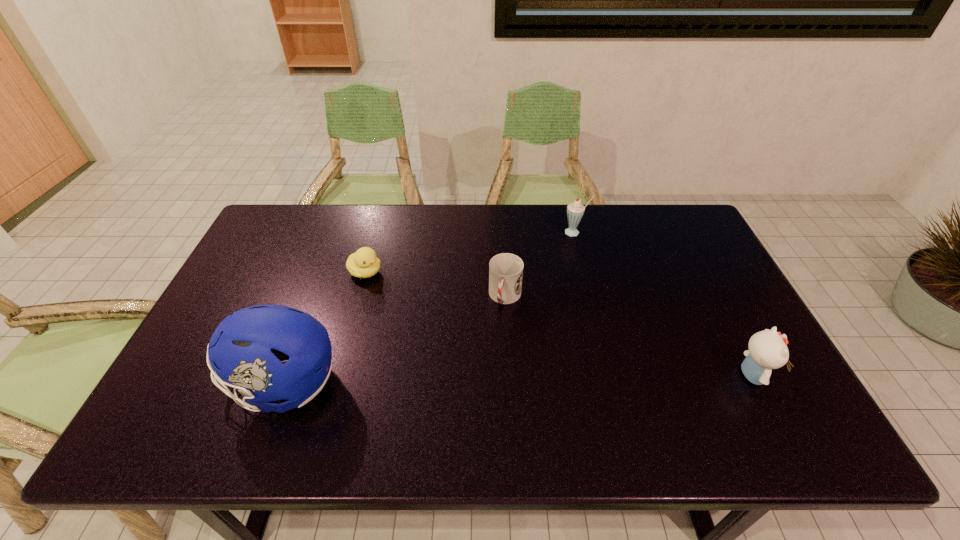
Identify the location of football helmet. The height and width of the screenshot is (540, 960). (246, 349).

Where is `the rightmost object`? the rightmost object is located at coordinates (768, 350).

Find the location of `cup`. cup is located at coordinates (505, 270).

I want to click on duckling, so click(364, 263).

Image resolution: width=960 pixels, height=540 pixels. Find the location of `the fourth object from left to right`. the fourth object from left to right is located at coordinates pyautogui.click(x=575, y=210).

The width and height of the screenshot is (960, 540). I want to click on milkshake, so click(x=575, y=210).

Find the location of a particular element. The width and height of the screenshot is (960, 540). vacant position located 0.120m on the face guard of the football helmet is located at coordinates click(175, 385).

This screenshot has width=960, height=540. Find the location of `vacant space situated on the handle side of the third object from left to right`. vacant space situated on the handle side of the third object from left to right is located at coordinates (493, 342).

Where is `free spot located 0.150m on the handle side of the third object from left to right`? free spot located 0.150m on the handle side of the third object from left to right is located at coordinates (490, 357).

Where is `vacant space located 0.070m on the handle side of the third object from left to right`? Image resolution: width=960 pixels, height=540 pixels. vacant space located 0.070m on the handle side of the third object from left to right is located at coordinates (496, 333).